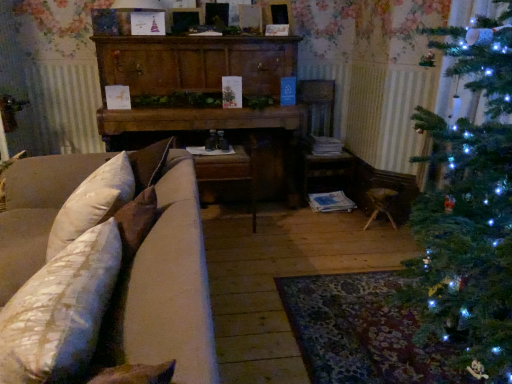
Question: From the image's perspective, would you say white textured pillow at lower left is positioned over wooden armchair at center?

Choices:
 (A) yes
 (B) no

Answer: (B)

Question: Is wooden armchair at center inside white textured pillow at lower left?

Choices:
 (A) yes
 (B) no

Answer: (B)

Question: Does white textured pillow at lower left lie in front of wooden armchair at center?

Choices:
 (A) no
 (B) yes

Answer: (B)

Question: Is white textured pillow at lower left positioned with its back to wooden armchair at center?

Choices:
 (A) yes
 (B) no

Answer: (B)

Question: Does white textured pillow at lower left have a larger size compared to wooden armchair at center?

Choices:
 (A) yes
 (B) no

Answer: (B)

Question: Do you think wooden armchair at center is within wooden dresser at center, or outside of it?

Choices:
 (A) outside
 (B) inside

Answer: (A)

Question: Is wooden armchair at center taller or shorter than wooden dresser at center?

Choices:
 (A) tall
 (B) short

Answer: (B)

Question: From a real-world perspective, is wooden armchair at center physically located above or below wooden dresser at center?

Choices:
 (A) below
 (B) above

Answer: (A)

Question: Based on their sizes in the image, would you say wooden armchair at center is bigger or smaller than wooden dresser at center?

Choices:
 (A) big
 (B) small

Answer: (B)

Question: Relative to wooden armchair at center, is white textured pillow at lower left in front or behind?

Choices:
 (A) behind
 (B) front

Answer: (B)

Question: Is white textured pillow at lower left to the left or to the right of wooden armchair at center in the image?

Choices:
 (A) right
 (B) left

Answer: (B)

Question: From the image's perspective, is white textured pillow at lower left located above or below wooden armchair at center?

Choices:
 (A) below
 (B) above

Answer: (A)

Question: Considering the positions of white textured pillow at lower left and wooden armchair at center in the image, is white textured pillow at lower left bigger or smaller than wooden armchair at center?

Choices:
 (A) small
 (B) big

Answer: (A)

Question: In terms of size, does wooden dresser at center appear bigger or smaller than wooden armchair at center?

Choices:
 (A) small
 (B) big

Answer: (B)

Question: Is point (287, 114) positioned closer to the camera than point (311, 168)?

Choices:
 (A) closer
 (B) farther

Answer: (A)